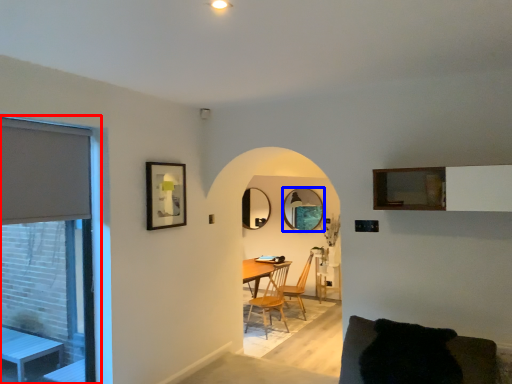
Question: Among these objects, which one is nearest to the camera, window (highlighted by a red box) or mirror (highlighted by a blue box)?

Choices:
 (A) window
 (B) mirror

Answer: (A)